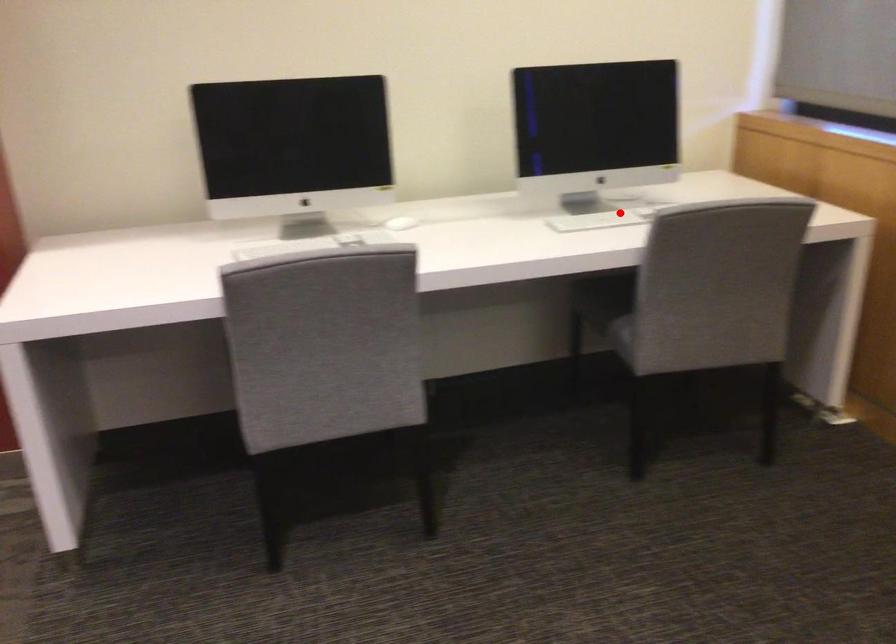
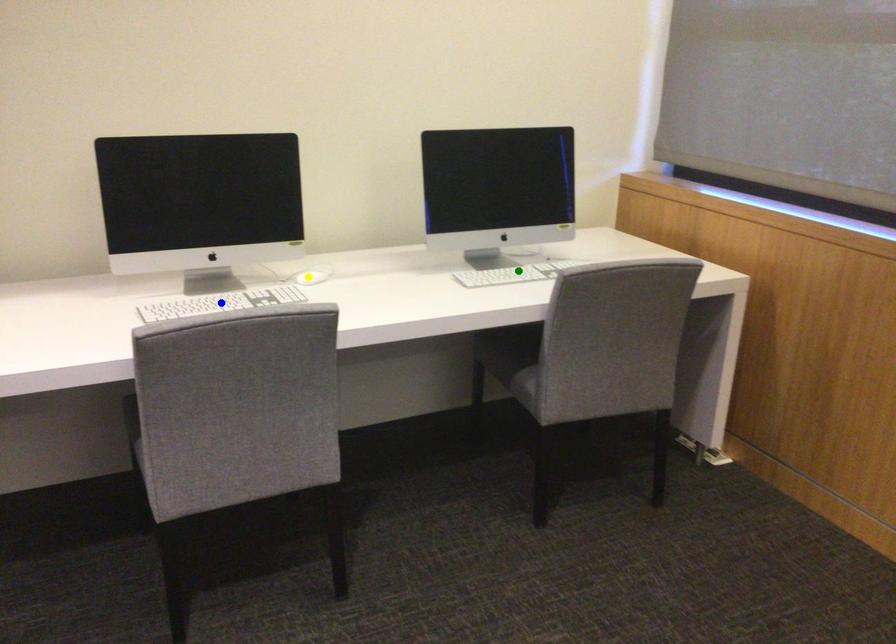
Question: I am providing you with two images of the same scene from different viewpoints. A red point is marked on the first image. You are given multiple points on the second image. Which point in image 2 is actually the same real-world point as the red point in image 1?

Choices:
 (A) yellow point
 (B) blue point
 (C) green point

Answer: (C)